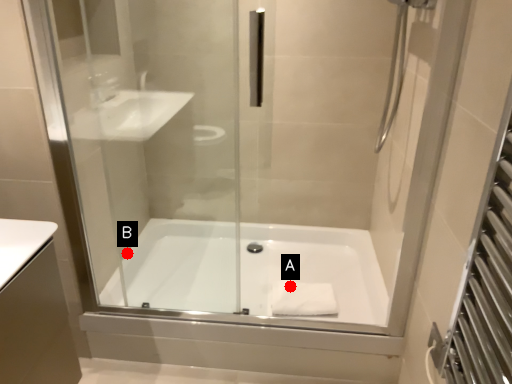
Question: Two points are circled on the image, labeled by A and B beside each circle. Among these points, which one is farthest from the camera?

Choices:
 (A) A is further
 (B) B is further

Answer: (B)